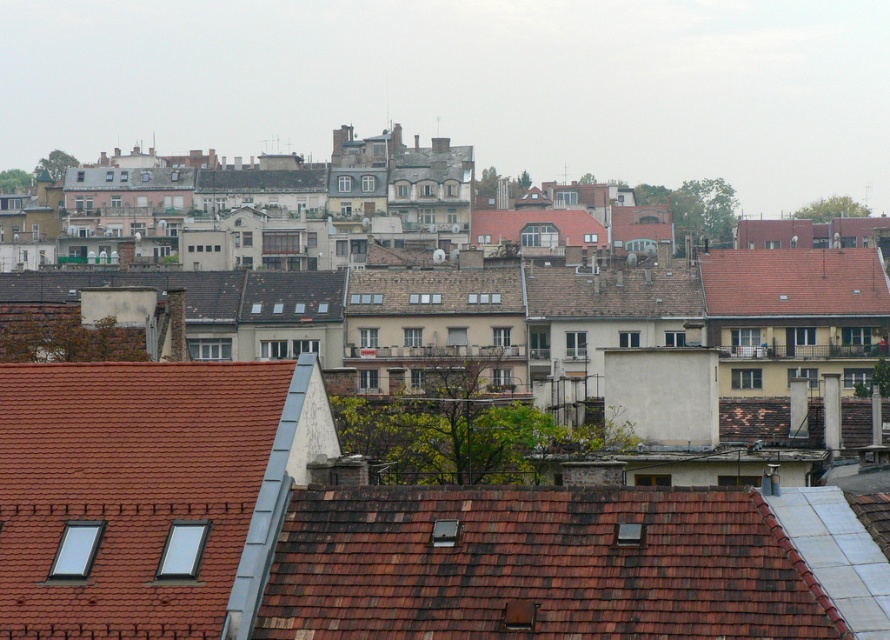
Can you confirm if brown shingles at center is positioned above red tile roof at upper right?

No.

How distant is brown shingles at center from red tile roof at upper right?

brown shingles at center is 102.39 meters away from red tile roof at upper right.

Which is behind, point (300, 550) or point (866, 305)?

Point (866, 305)

Where is `brown shingles at center`? The image size is (890, 640). brown shingles at center is located at coordinates (538, 564).